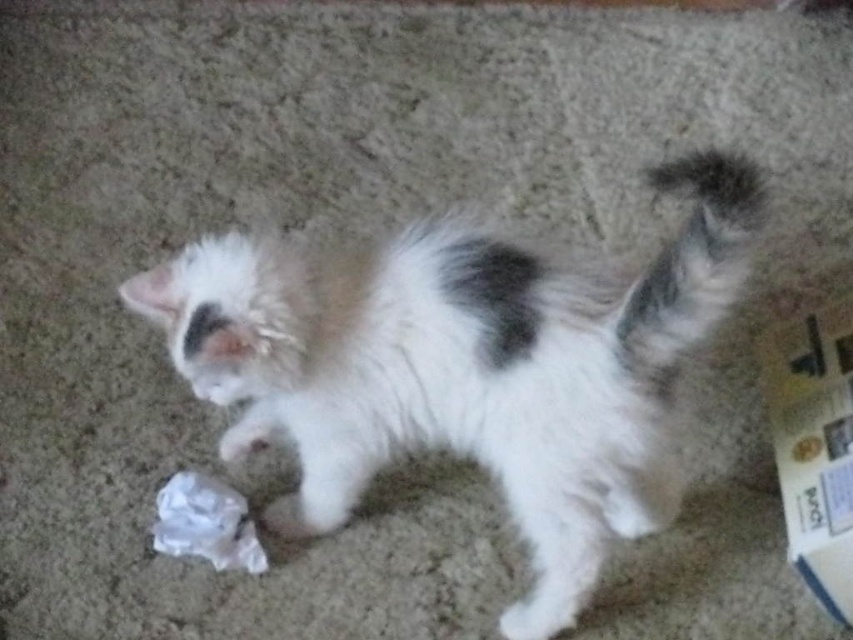
You are a photographer trying to capture a closeup shot of the white fluffy cat at center. You are currently 3.35 feet away from the cat. If you move 1 foot closer, will you be within the ideal 2.5 feet distance recommended for capturing detailed closeups?

The current distance between you and the white fluffy cat at center is 3.35 feet. Moving 1 foot closer would bring you to 2.35 feet away, which is within the ideal 2.5 feet distance recommended for capturing detailed closeups.

You are holding a 3.5 feet long fishing rod and standing in front of the scene. You want to cast the rod towards the point at point (653,356). Will the rod reach the point?

The point (653,356) is 3.63 feet from camera. Since the fishing rod is 3.5 feet long, it is slightly shorter than the distance required. Therefore, the rod will not reach the point.

You are a cat owner trying to clean up your home. You see the fluffy white tail at upper right and the white crumpled plastic at lower left. Which object is thinner?

The fluffy white tail at upper right is thinner than the white crumpled plastic at lower left because it has a lesser width.